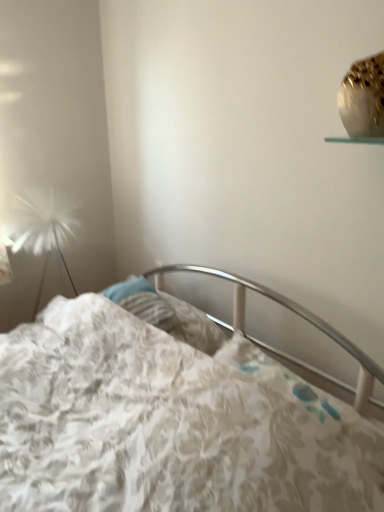
Question: From the image's perspective, is white fluffy lamp at left located above or below floral fabric bed at center?

Choices:
 (A) above
 (B) below

Answer: (A)

Question: Is white fluffy lamp at left wider or thinner than floral fabric bed at center?

Choices:
 (A) wide
 (B) thin

Answer: (B)

Question: From a real-world perspective, is white fluffy lamp at left positioned above or below floral fabric bed at center?

Choices:
 (A) below
 (B) above

Answer: (B)

Question: From a real-world perspective, is floral fabric bed at center physically located above or below white fluffy lamp at left?

Choices:
 (A) above
 (B) below

Answer: (B)

Question: Is floral fabric bed at center situated inside white fluffy lamp at left or outside?

Choices:
 (A) outside
 (B) inside

Answer: (A)

Question: Is floral fabric bed at center taller or shorter than white fluffy lamp at left?

Choices:
 (A) short
 (B) tall

Answer: (B)

Question: Does point (271, 388) appear closer or farther from the camera than point (29, 234)?

Choices:
 (A) closer
 (B) farther

Answer: (A)